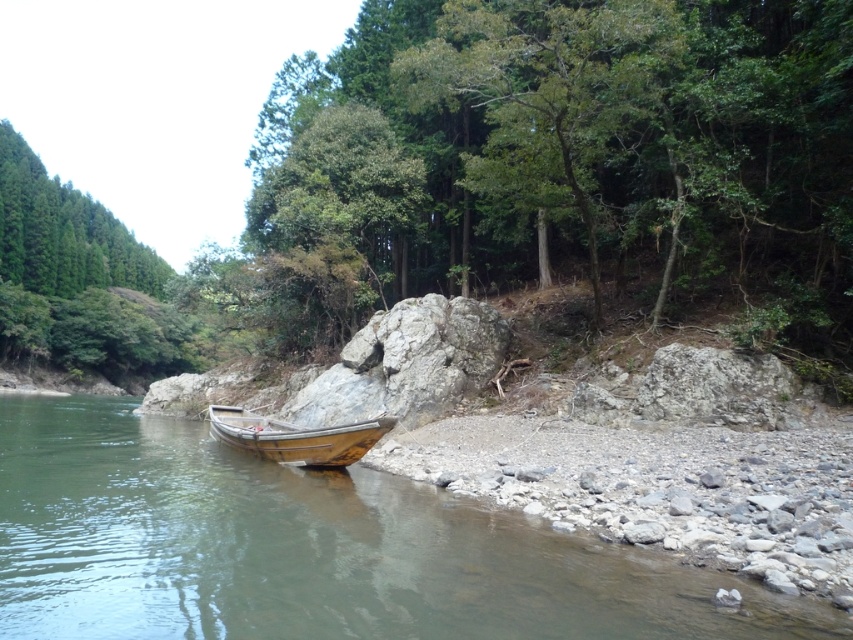
Which of these two, green leafy tree at center or wooden boat at lower left, stands shorter?

With less height is wooden boat at lower left.

Who is more forward, (561, 250) or (128, 493)?

Point (128, 493)

I want to click on green leafy tree at center, so click(x=583, y=147).

Does wooden boat at lower left have a smaller size compared to wooden boat at center?

Incorrect, wooden boat at lower left is not smaller in size than wooden boat at center.

Is point (242, 541) more distant than point (315, 448)?

No, it is in front of (315, 448).

In order to click on wooden boat at lower left in this screenshot , I will do `click(309, 548)`.

Between green leafy tree at center and wooden boat at center, which one is positioned lower?

wooden boat at center

Between point (447, 80) and point (340, 428), which one is positioned in front?

Point (340, 428)

Does point (602, 204) come farther from viewer compared to point (251, 413)?

No, it is not.

I want to click on green leafy tree at center, so click(583, 147).